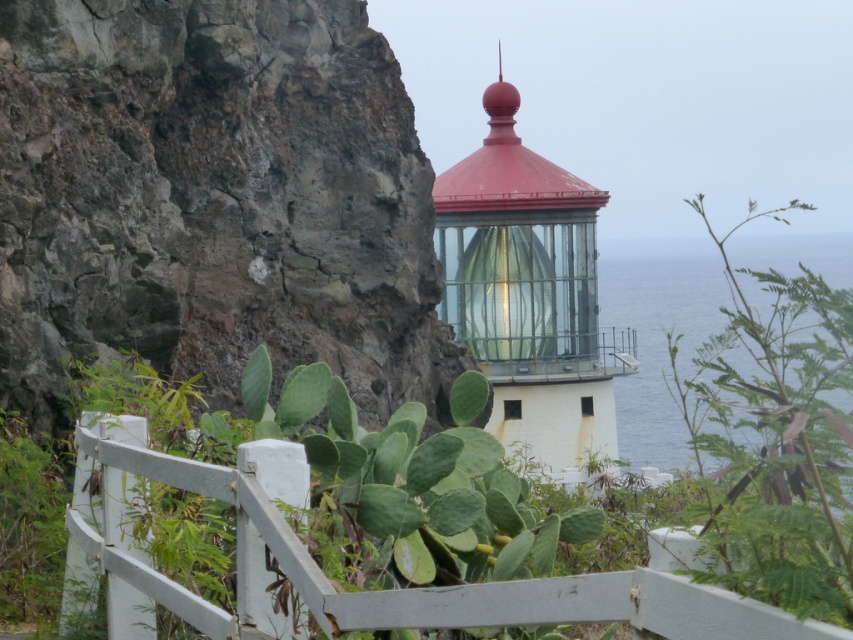
Looking at this image, is white wooden fence at center behind green leafy cactus at lower left?

No, it is in front of green leafy cactus at lower left.

Does white wooden fence at center appear on the right side of green leafy cactus at lower left?

Indeed, white wooden fence at center is positioned on the right side of green leafy cactus at lower left.

The width and height of the screenshot is (853, 640). Identify the location of white wooden fence at center. (392, 589).

Locate an element on the screen. Image resolution: width=853 pixels, height=640 pixels. white wooden fence at center is located at coordinates (392, 589).

Between green leafy plant at upper right and green leafy cactus at lower left, which one is positioned higher?

green leafy plant at upper right is higher up.

Is green leafy plant at upper right to the right of green leafy cactus at lower left from the viewer's perspective?

Indeed, green leafy plant at upper right is positioned on the right side of green leafy cactus at lower left.

Find the location of a particular element. Image resolution: width=853 pixels, height=640 pixels. green leafy plant at upper right is located at coordinates [776, 438].

Can you confirm if green leafy plant at upper right is shorter than white wooden fence at center?

No, green leafy plant at upper right is not shorter than white wooden fence at center.

In the scene shown: Does green leafy plant at upper right appear on the left side of white wooden fence at center?

No, green leafy plant at upper right is not to the left of white wooden fence at center.

The height and width of the screenshot is (640, 853). What do you see at coordinates (776, 438) in the screenshot?
I see `green leafy plant at upper right` at bounding box center [776, 438].

Locate an element on the screen. Image resolution: width=853 pixels, height=640 pixels. green leafy plant at upper right is located at coordinates (776, 438).